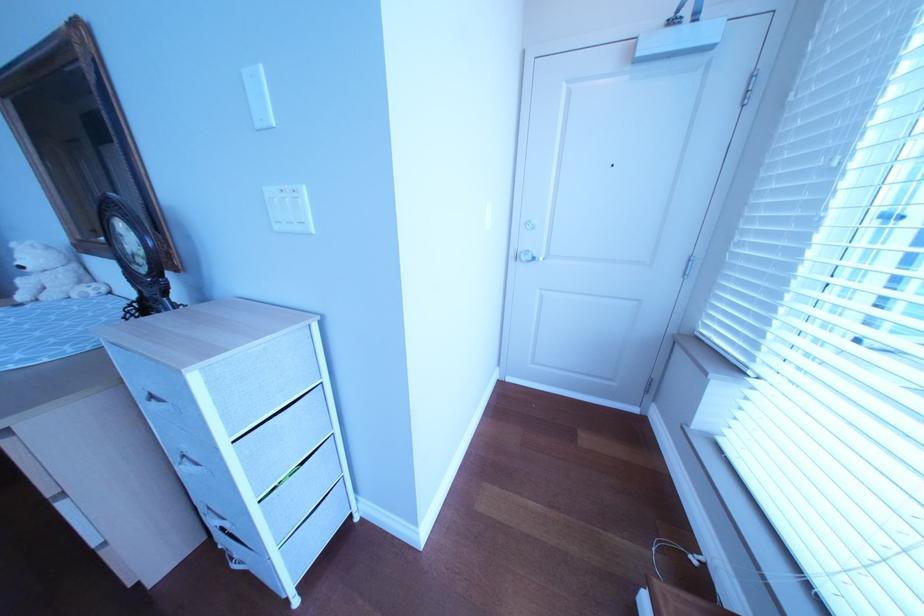
Locate an element on the screen. The image size is (924, 616). silver deadbolt knob is located at coordinates (526, 256).